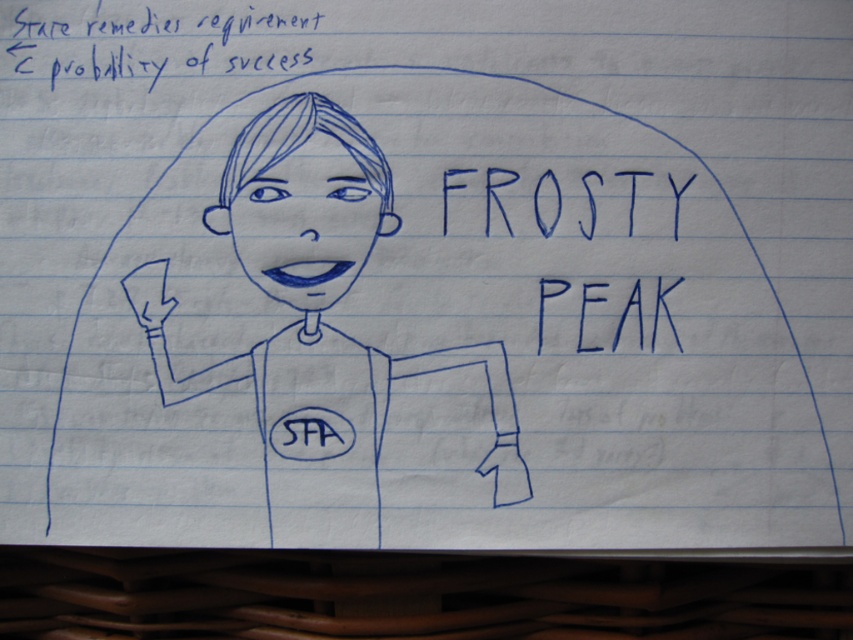
You are an art student analyzing a drawing. You notice the blue line drawing girl at center and the blue ink writing at upper left. Which one takes up more space horizontally?

The blue line drawing girl at center takes up more space horizontally because her width is larger than that of the blue ink writing at upper left.

You are an art student analyzing this drawing. You need to determine the spatial relationship between the blue line drawing girl at center and the blue handwritten text at upper center. Which object is located to the left?

The blue line drawing girl at center is positioned on the left side of blue handwritten text at upper center, so the girl is to the left of the text.

You are an art student analyzing this drawing. You need to determine if the blue line drawing girl at center will fit on a 10cm tall sticky note placed below the blue ink writing at upper left. Can you confirm?

The blue line drawing girl at center is much taller than the blue ink writing at upper left, so it may not fit on a 10cm tall sticky note placed below the blue ink writing at upper left.